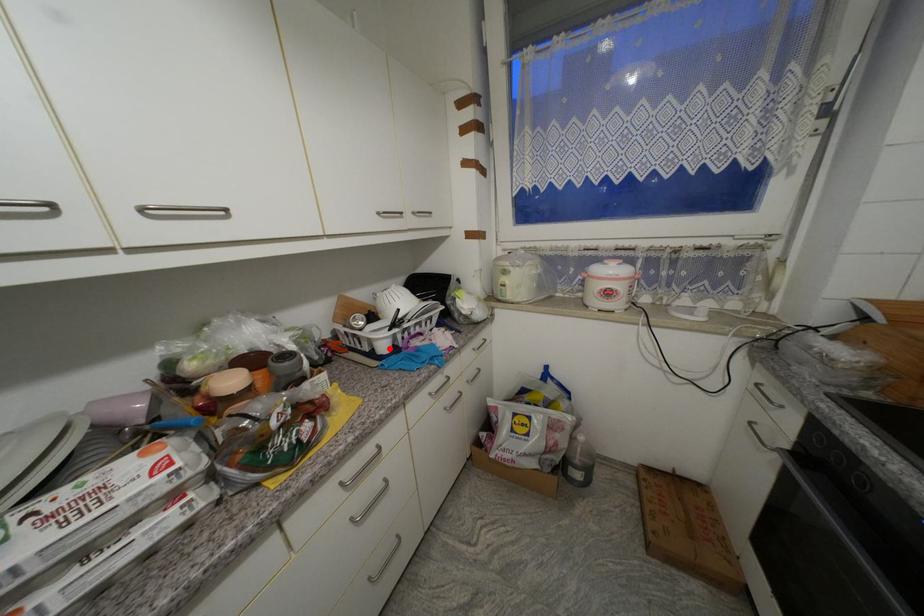
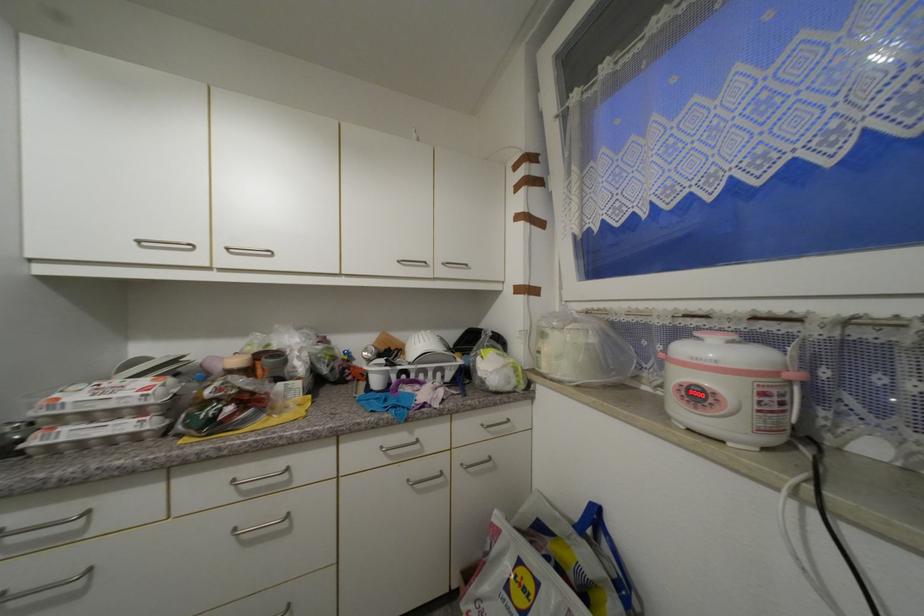
Where in the second image is the point corresponding to the highlighted location from the first image?

(382, 384)